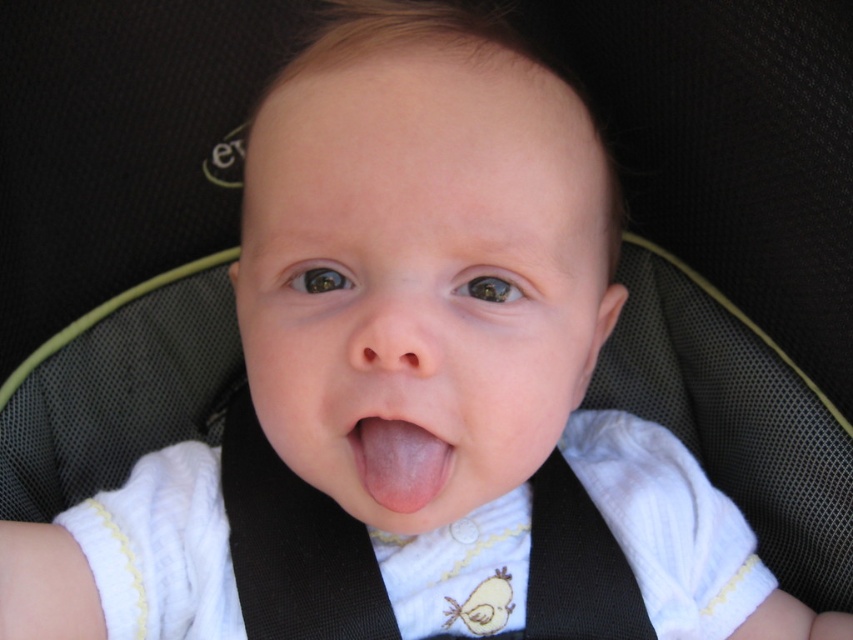
Question: Does white ribbed fabric bib at center appear on the left side of pink smooth tongue at center?

Choices:
 (A) yes
 (B) no

Answer: (B)

Question: Which of the following is the closest to the observer?

Choices:
 (A) pink smooth tongue at center
 (B) white ribbed fabric bib at center

Answer: (A)

Question: Does white ribbed fabric bib at center have a larger size compared to pink smooth tongue at center?

Choices:
 (A) yes
 (B) no

Answer: (A)

Question: Does white ribbed fabric bib at center appear under pink smooth tongue at center?

Choices:
 (A) no
 (B) yes

Answer: (B)

Question: Which of the following is the closest to the observer?

Choices:
 (A) pink smooth tongue at center
 (B) white ribbed fabric bib at center

Answer: (A)